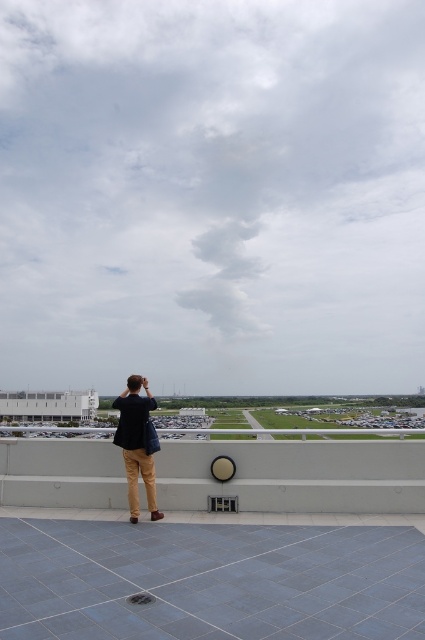
You are standing on the roof and want to place a small potted plant between the two points, point [275,456] and point [135,378]. Which point should you move towards to ensure the plant is closer to the edge of the roof?

You should move towards point [135,378] because it is closer to the edge of the roof compared to point [275,456].